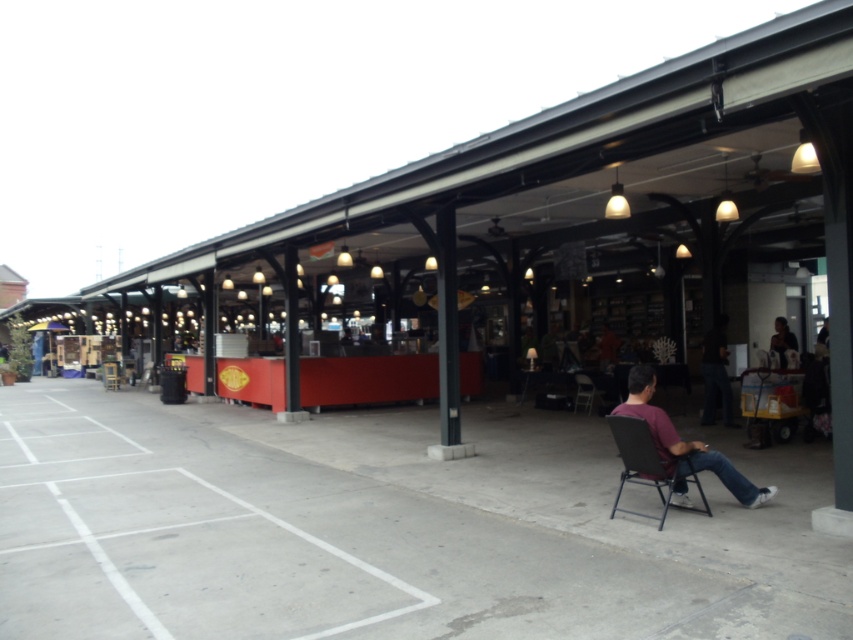
Question: Among these points, which one is farthest from the camera?

Choices:
 (A) (635, 426)
 (B) (596, 396)

Answer: (B)

Question: Can you confirm if dark brown fabric chair at lower right is thinner than metallic gray folding chair at lower right?

Choices:
 (A) yes
 (B) no

Answer: (B)

Question: Which of the following is the farthest from the observer?

Choices:
 (A) (589, 385)
 (B) (677, 467)

Answer: (A)

Question: Does dark brown fabric chair at lower right have a larger size compared to dark blue jeans at center-right?

Choices:
 (A) no
 (B) yes

Answer: (A)

Question: Which point appears closest to the camera in this image?

Choices:
 (A) (706, 387)
 (B) (653, 472)
 (C) (741, 492)
 (D) (590, 394)

Answer: (B)

Question: Does dark blue jeans at center-right appear on the left side of matte black chair at center?

Choices:
 (A) yes
 (B) no

Answer: (B)